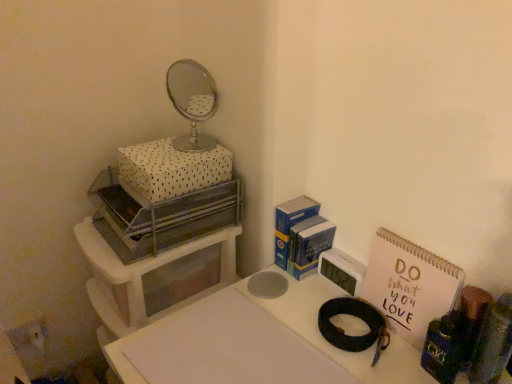
The width and height of the screenshot is (512, 384). Find the location of `vacant area that lies between white plastic clock at center-right, which is the 1th appliance from back to front, and shiny metallic magnifying glass at upper center`. vacant area that lies between white plastic clock at center-right, which is the 1th appliance from back to front, and shiny metallic magnifying glass at upper center is located at coordinates (327, 300).